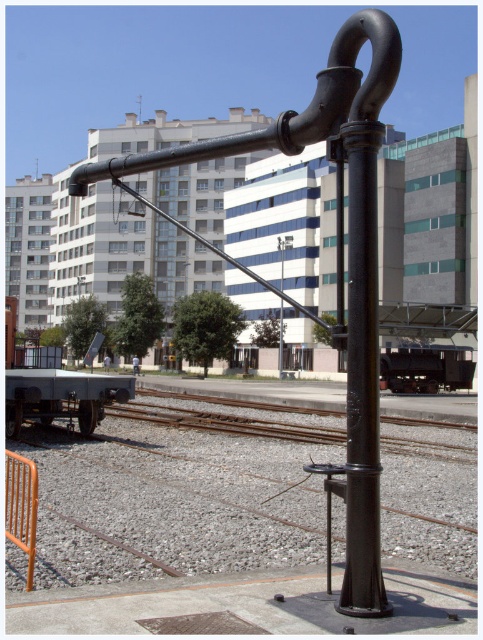
From the picture: You are a maintenance worker checking the railway area. You notice the black matte pipe at center and the orange metallic rail at lower left. Which object is taller?

The black matte pipe at center is taller than the orange metallic rail at lower left according to the description.

You are a maintenance worker needing to access the black metal lamp post at center. There is an orange metallic rail at lower left in your path. Can you walk directly to the lamp post without going around the rail?

The orange metallic rail at lower left is in front of the black metal lamp post at center, so you cannot walk directly to the lamp post without going around the rail.